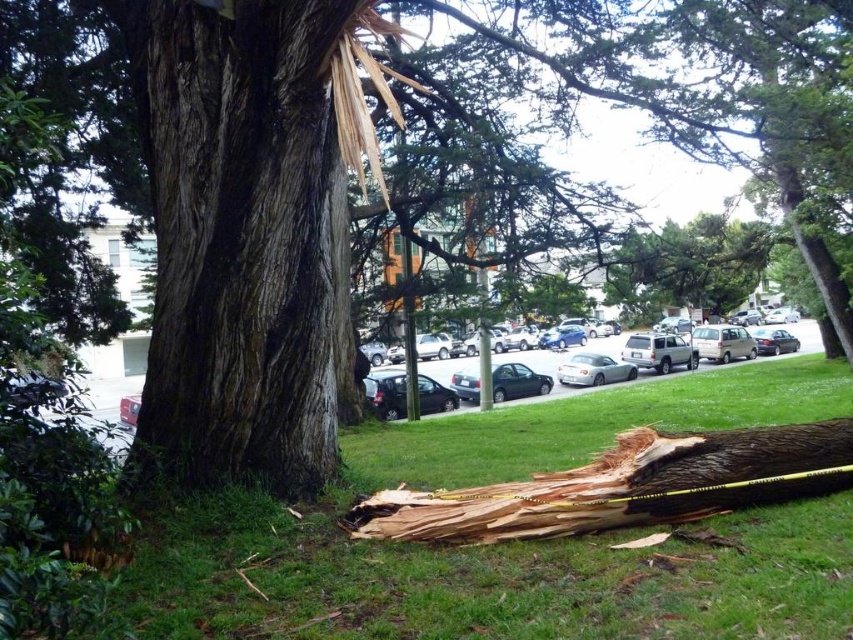
Question: Which of the following is the closest to the observer?

Choices:
 (A) satin silver car at center
 (B) green grass at lower center
 (C) dark brown rough bark tree trunk at center
 (D) silver metallic sedan at center

Answer: (B)

Question: Is green grass at lower center smaller than satin silver car at center?

Choices:
 (A) yes
 (B) no

Answer: (A)

Question: Which point is farther from the camera taking this photo?

Choices:
 (A) (558, 365)
 (B) (840, 560)
 (C) (494, 376)

Answer: (A)

Question: Where is dark brown rough bark tree trunk at center located in relation to satin silver car at center in the image?

Choices:
 (A) above
 (B) below

Answer: (A)

Question: Which point is closer to the camera?

Choices:
 (A) (801, 524)
 (B) (178, 408)

Answer: (A)

Question: Is green grass at lower center to the right of satin silver car at center from the viewer's perspective?

Choices:
 (A) yes
 (B) no

Answer: (B)